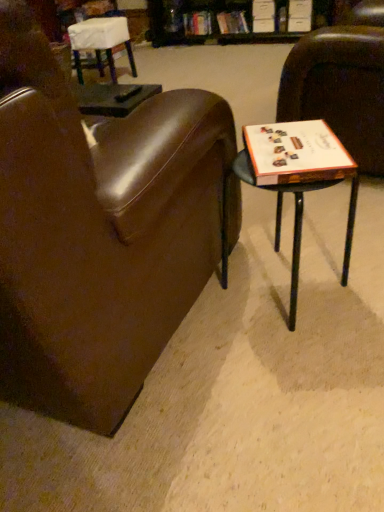
The width and height of the screenshot is (384, 512). Find the location of `vacant point above wooden table at right (from a real-world perspective)`. vacant point above wooden table at right (from a real-world perspective) is located at coordinates (296, 150).